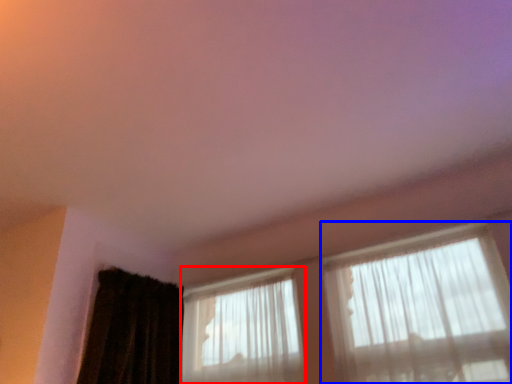
Question: Which of the following is the farthest to the observer, window (highlighted by a red box) or window (highlighted by a blue box)?

Choices:
 (A) window
 (B) window

Answer: (A)